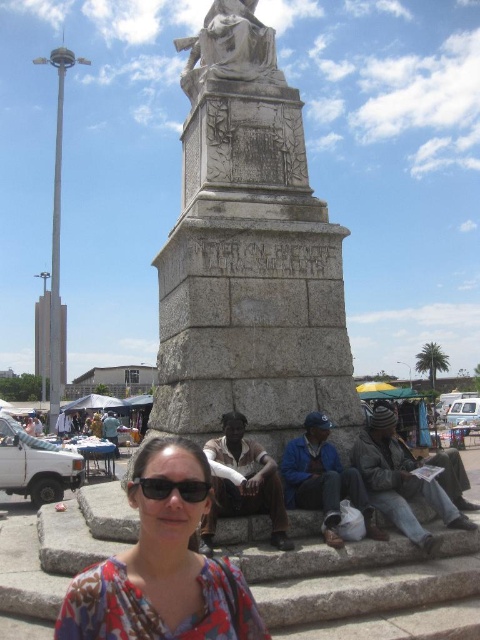
Question: Which of the following is the closest to the observer?

Choices:
 (A) floral fabric blouse at lower center
 (B) gray stone monument at center

Answer: (A)

Question: Does floral fabric blouse at lower center appear on the right side of black plastic sunglasses at center?

Choices:
 (A) no
 (B) yes

Answer: (A)

Question: Estimate the real-world distances between objects in this image. Which object is farther from the floral fabric blouse at lower center?

Choices:
 (A) gray stone monument at center
 (B) black plastic sunglasses at center

Answer: (A)

Question: Which point appears closest to the camera in this image?

Choices:
 (A) (182, 294)
 (B) (156, 456)
 (C) (206, 488)

Answer: (C)

Question: Is floral fabric blouse at lower center bigger than black plastic sunglasses at center?

Choices:
 (A) yes
 (B) no

Answer: (A)

Question: Can you confirm if gray stone monument at center is bigger than floral fabric blouse at lower center?

Choices:
 (A) no
 (B) yes

Answer: (B)